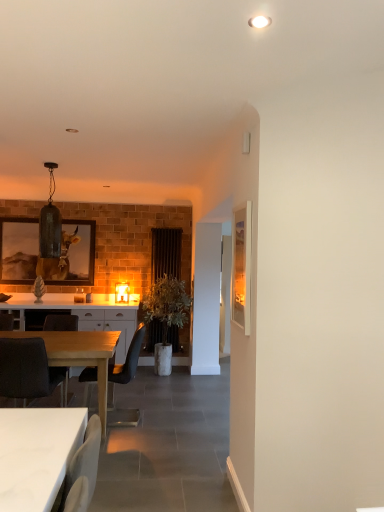
Question: From the image's perspective, is matte glass pendant light at upper left, which is the 1th lamp from left to right, located beneath matte glass lampshade at center, the 2th lamp positioned from the top?

Choices:
 (A) no
 (B) yes

Answer: (A)

Question: Considering the relative sizes of matte glass pendant light at upper left, which ranks as the 1th lamp in top-to-bottom order, and matte glass lampshade at center, which is the second lamp from front to back, in the image provided, is matte glass pendant light at upper left, which ranks as the 1th lamp in top-to-bottom order, smaller than matte glass lampshade at center, which is the second lamp from front to back,?

Choices:
 (A) yes
 (B) no

Answer: (B)

Question: Does matte glass pendant light at upper left, the second lamp when ordered from bottom to top, have a lesser width compared to matte glass lampshade at center, the 2th lamp positioned from the left?

Choices:
 (A) yes
 (B) no

Answer: (B)

Question: Are matte glass pendant light at upper left, the 1th lamp viewed from the front, and matte glass lampshade at center, which is the second lamp from front to back, beside each other?

Choices:
 (A) yes
 (B) no

Answer: (B)

Question: From the image's perspective, is matte glass pendant light at upper left, the second lamp when ordered from bottom to top, over matte glass lampshade at center, which is the second lamp from front to back?

Choices:
 (A) yes
 (B) no

Answer: (A)

Question: Does matte glass pendant light at upper left, which ranks as the 1th lamp in top-to-bottom order, lie in front of matte glass lampshade at center, which is counted as the first lamp, starting from the right?

Choices:
 (A) no
 (B) yes

Answer: (B)

Question: Is matte glass pendant light at upper left, which ranks as the 1th lamp in top-to-bottom order, positioned with its back to matte black chair at center, marked as the second chair in a front-to-back arrangement?

Choices:
 (A) yes
 (B) no

Answer: (B)

Question: From a real-world perspective, is matte glass pendant light at upper left, which is the 1th lamp from left to right, beneath matte black chair at center, marked as the 2th chair in a back-to-front arrangement?

Choices:
 (A) no
 (B) yes

Answer: (A)

Question: Are matte glass pendant light at upper left, the second lamp when ordered from bottom to top, and matte black chair at center, marked as the second chair in a front-to-back arrangement, located far from each other?

Choices:
 (A) yes
 (B) no

Answer: (A)

Question: Does matte glass pendant light at upper left, which appears as the 2th lamp when viewed from the right, have a greater width compared to matte black chair at center, marked as the 2th chair in a back-to-front arrangement?

Choices:
 (A) no
 (B) yes

Answer: (A)

Question: Is matte glass pendant light at upper left, the 1th lamp viewed from the front, outside matte black chair at center, marked as the second chair in a front-to-back arrangement?

Choices:
 (A) no
 (B) yes

Answer: (B)

Question: Can you confirm if matte glass pendant light at upper left, which is the 1th lamp from left to right, is thinner than matte black chair at center, marked as the second chair in a front-to-back arrangement?

Choices:
 (A) yes
 (B) no

Answer: (A)

Question: Would you say matte glass lampshade at center, the 2th lamp positioned from the top, is outside matte black chair at center, marked as the second chair in a front-to-back arrangement?

Choices:
 (A) yes
 (B) no

Answer: (A)